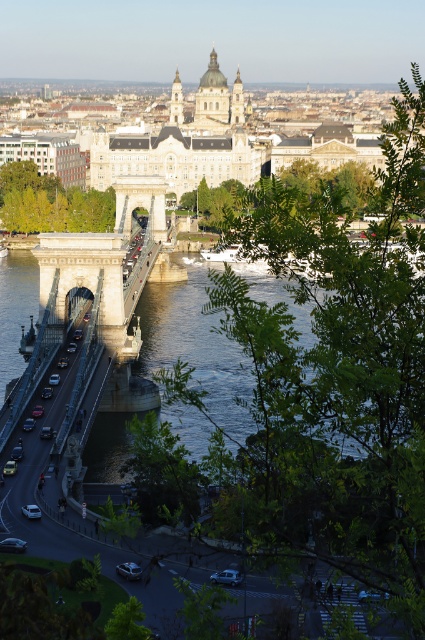
Question: Which object is the farthest from the silver metallic car at lower center?

Choices:
 (A) clear water at center
 (B) silver metallic car at lower left
 (C) matte silver car at lower left
 (D) metallic chain-link bridge at center

Answer: (D)

Question: Is metallic chain-link bridge at center below matte silver car at lower left?

Choices:
 (A) no
 (B) yes

Answer: (A)

Question: Where is metallic chain-link bridge at center located in relation to silver metallic car at lower center in the image?

Choices:
 (A) right
 (B) left

Answer: (B)

Question: Which of these objects is positioned farthest from the silver metallic car at lower center?

Choices:
 (A) clear water at center
 (B) silver metallic car at lower left
 (C) matte silver car at lower left
 (D) shiny silver car at left

Answer: (A)

Question: Which object is positioned closest to the clear water at center?

Choices:
 (A) metallic chain-link bridge at center
 (B) shiny silver car at left
 (C) silver metallic car at lower left
 (D) matte silver car at lower left

Answer: (A)

Question: Is clear water at center thinner than silver metallic car at lower left?

Choices:
 (A) no
 (B) yes

Answer: (A)